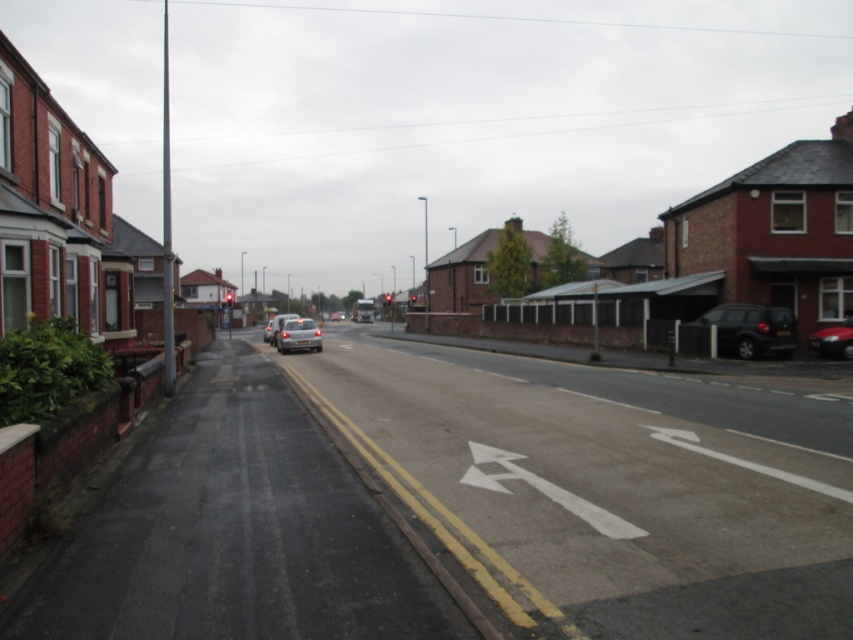
Question: Observing the image, what is the correct spatial positioning of white matte van at center in reference to silver metallic car at center-left?

Choices:
 (A) below
 (B) above

Answer: (B)

Question: Which point appears farthest from the camera in this image?

Choices:
 (A) (741, 317)
 (B) (263, 337)
 (C) (645, 616)

Answer: (B)

Question: Estimate the real-world distances between objects in this image. Which object is farther from the shiny red car at right?

Choices:
 (A) silver metallic car at center-left
 (B) matte black suv at right
 (C) white matte van at center
 (D) smooth asphalt road at center

Answer: (A)

Question: Is silver metallic car at center further to camera compared to shiny red car at right?

Choices:
 (A) no
 (B) yes

Answer: (B)

Question: Which point is farther to the camera?

Choices:
 (A) (289, 314)
 (B) (293, 342)
 (C) (836, 326)
 (D) (265, 340)

Answer: (A)

Question: Is matte black suv at right positioned at the back of white matte van at center?

Choices:
 (A) yes
 (B) no

Answer: (B)